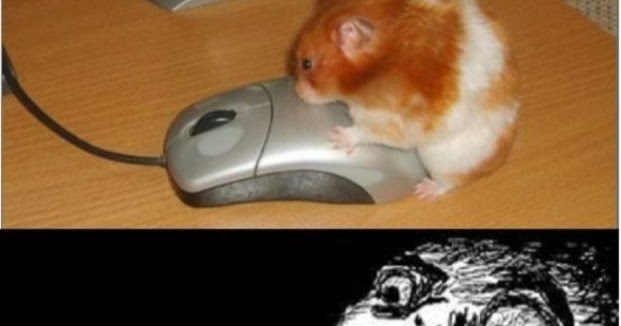
This screenshot has width=621, height=326. I want to click on cord, so click(x=117, y=155).